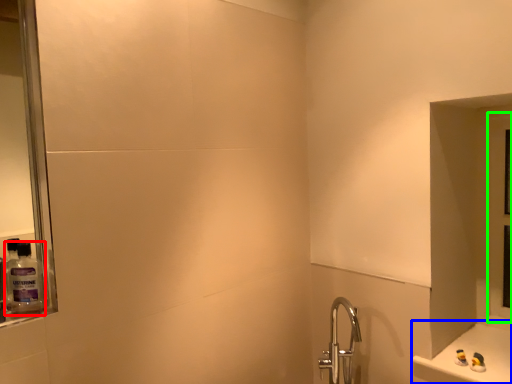
Question: Which object is the closest to the mouthwash (highlighted by a red box)? Choose among these: counter (highlighted by a blue box) or glass door (highlighted by a green box).

Choices:
 (A) counter
 (B) glass door

Answer: (A)